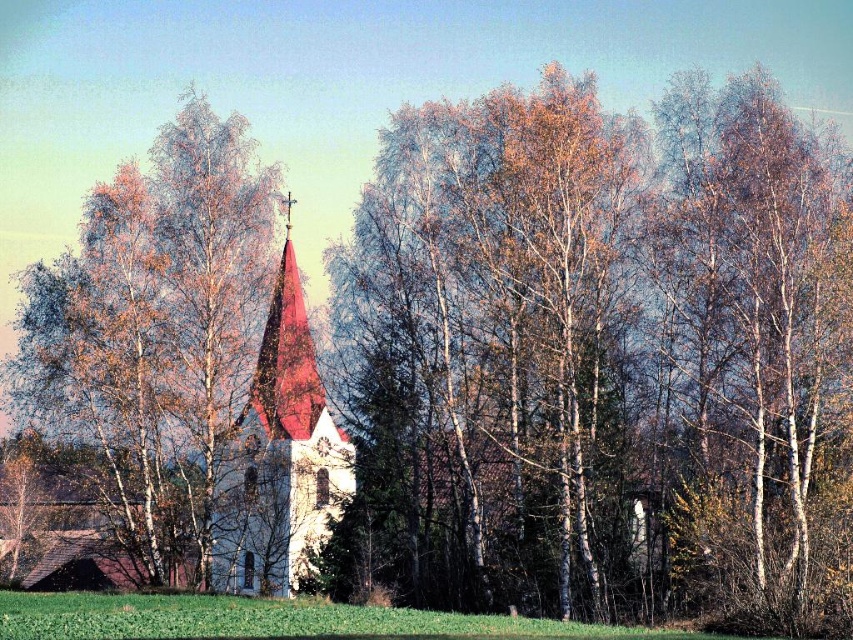
Does point (338, 476) come farther from viewer compared to point (6, 618)?

Yes, it is behind point (6, 618).

In the scene shown: Can you confirm if matte red steeple at center is bigger than green grassy field at lower center?

Yes.

At what (x,y) coordinates should I click in order to perform the action: click on matte red steeple at center. Please return your answer as a coordinate pair (x, y). Image resolution: width=853 pixels, height=640 pixels. Looking at the image, I should click on (270, 460).

Is smooth white bark at center above matte red steeple at center?

Indeed, smooth white bark at center is positioned over matte red steeple at center.

Between smooth white bark at center and matte red steeple at center, which one appears on the right side from the viewer's perspective?

Positioned to the right is smooth white bark at center.

Find the location of a particular element. The width and height of the screenshot is (853, 640). smooth white bark at center is located at coordinates (596, 349).

Is the position of smooth white bark at center less distant than that of smooth red steeple at center?

Yes.

Is smooth white bark at center taller than smooth red steeple at center?

Correct, smooth white bark at center is much taller as smooth red steeple at center.

The height and width of the screenshot is (640, 853). Find the location of `smooth white bark at center`. smooth white bark at center is located at coordinates (596, 349).

Identify the location of smooth white bark at center. (596, 349).